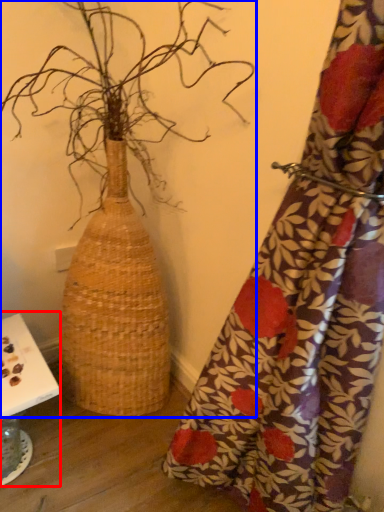
Question: Which object appears closest to the camera in this image, table (highlighted by a red box) or houseplant (highlighted by a blue box)?

Choices:
 (A) table
 (B) houseplant

Answer: (B)